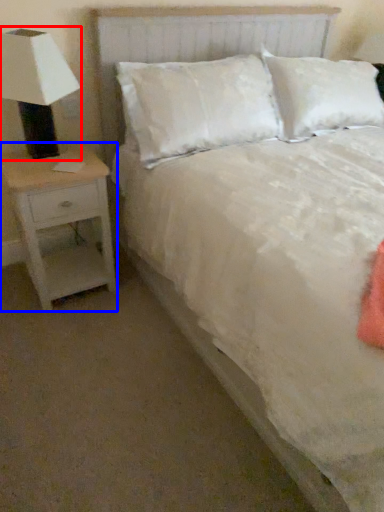
Question: Which of the following is the closest to the observer, lamp (highlighted by a red box) or nightstand (highlighted by a blue box)?

Choices:
 (A) lamp
 (B) nightstand

Answer: (A)